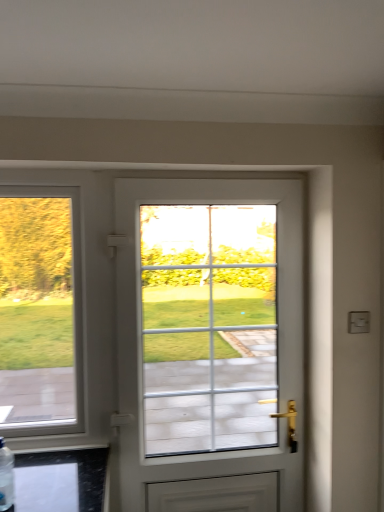
Question: Is point (208, 440) positioned closer to the camera than point (13, 496)?

Choices:
 (A) closer
 (B) farther

Answer: (B)

Question: Is white glossy door at center inside the boundaries of clear plastic bottle at lower left, or outside?

Choices:
 (A) inside
 (B) outside

Answer: (B)

Question: Considering the positions of white glossy door at center and clear plastic bottle at lower left in the image, is white glossy door at center taller or shorter than clear plastic bottle at lower left?

Choices:
 (A) tall
 (B) short

Answer: (A)

Question: In the image, is clear plastic bottle at lower left positioned in front of or behind white glossy door at center?

Choices:
 (A) front
 (B) behind

Answer: (A)

Question: Considering the positions of clear plastic bottle at lower left and white glossy door at center in the image, is clear plastic bottle at lower left taller or shorter than white glossy door at center?

Choices:
 (A) short
 (B) tall

Answer: (A)

Question: From the image's perspective, is clear plastic bottle at lower left positioned above or below white glossy door at center?

Choices:
 (A) above
 (B) below

Answer: (B)

Question: Considering the positions of clear plastic bottle at lower left and white glossy door at center in the image, is clear plastic bottle at lower left bigger or smaller than white glossy door at center?

Choices:
 (A) small
 (B) big

Answer: (A)